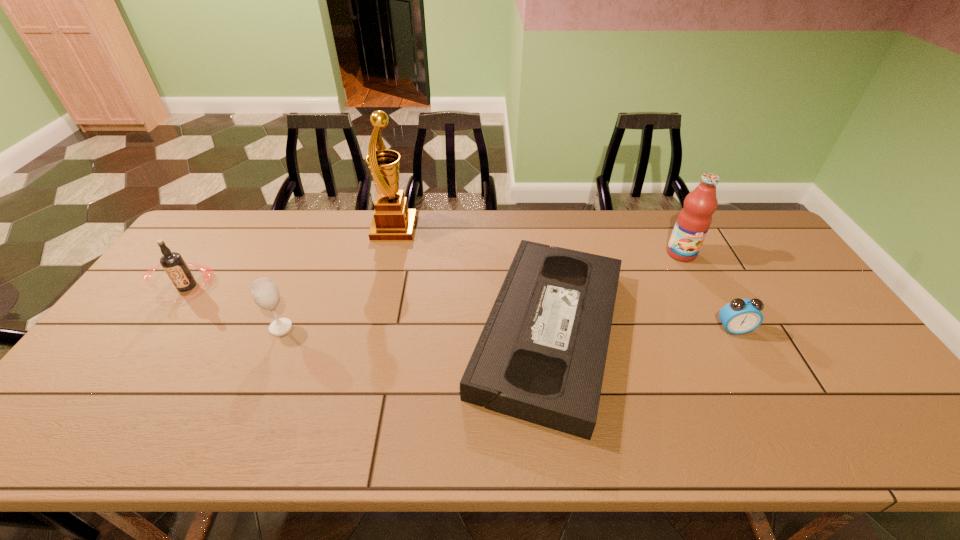
You are a GUI agent. You are given a task and a screenshot of the screen. Output one action in this format:
    pyautogui.click(x=<x>, y=<y>)
    Task: Click on the blank space at the left edge of the desktop
    
    Given the screenshot: What is the action you would take?
    pyautogui.click(x=100, y=411)

In the image, there is a desktop. Where is `vacant space at the near left corner`? The image size is (960, 540). vacant space at the near left corner is located at coordinates (87, 452).

The width and height of the screenshot is (960, 540). Identify the location of vacant area between the fourth object from left to right and the alarm clock. (641, 330).

The height and width of the screenshot is (540, 960). Find the location of `free space between the fourth object from left to right and the second object from left to right`. free space between the fourth object from left to right and the second object from left to right is located at coordinates (415, 330).

You are a GUI agent. You are given a task and a screenshot of the screen. Output one action in this format:
    pyautogui.click(x=<x>, y=<y>)
    Task: Click on the blank region between the root beer and the wineglass
    The width and height of the screenshot is (960, 540).
    Given the screenshot: What is the action you would take?
    pyautogui.click(x=234, y=307)

The height and width of the screenshot is (540, 960). In order to click on vacant space that is in between the fifth tallest object and the third object from right to left in this screenshot , I will do `click(641, 330)`.

Image resolution: width=960 pixels, height=540 pixels. In order to click on free area in between the fifth shortest object and the wineglass in this screenshot , I will do `click(481, 291)`.

Where is `blank region between the third object from right to left and the leftmost object`? blank region between the third object from right to left and the leftmost object is located at coordinates (368, 309).

At what (x,y) coordinates should I click in order to perform the action: click on vacant space that is in between the alarm clock and the fruit juice. Please return your answer as a coordinate pair (x, y). Looking at the image, I should click on (708, 291).

Locate an element on the screen. unoccupied area between the second object from left to right and the tallest object is located at coordinates (338, 278).